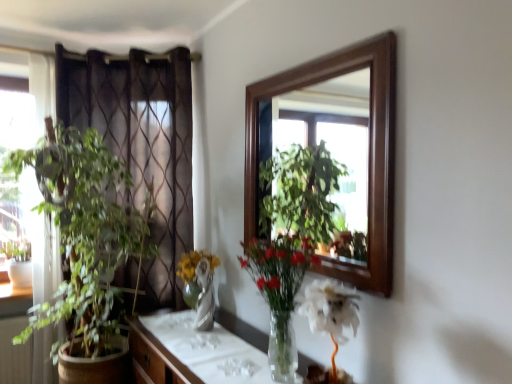
At what (x,y) coordinates should I click in order to perform the action: click on wooden cabinet at center. Please return your answer as a coordinate pair (x, y). This screenshot has height=384, width=512. Looking at the image, I should click on (193, 353).

This screenshot has width=512, height=384. What do you see at coordinates (280, 292) in the screenshot? I see `translucent glass vase at center, positioned as the first houseplant in front-to-back order` at bounding box center [280, 292].

How much space does translucent glass vase at center, positioned as the first houseplant in front-to-back order, occupy horizontally?

It is 5.62 inches.

Locate an element on the screen. The height and width of the screenshot is (384, 512). brown sheer curtain at left is located at coordinates (141, 143).

In the scene shown: Can translucent glass vase at center, positioned as the first houseplant in front-to-back order, be found inside wooden cabinet at center?

No, translucent glass vase at center, positioned as the first houseplant in front-to-back order, is located outside of wooden cabinet at center.

Between wooden cabinet at center and translucent glass vase at center, which is the second houseplant from left to right, which one has smaller width?

translucent glass vase at center, which is the second houseplant from left to right.

Identify the location of the 1st houseplant located above the wooden cabinet at center (from a real-world perspective). Image resolution: width=512 pixels, height=384 pixels. (280, 292).

Considering the relative sizes of wooden cabinet at center and translucent glass vase at center, marked as the 1th houseplant in a right-to-left arrangement, in the image provided, is wooden cabinet at center bigger than translucent glass vase at center, marked as the 1th houseplant in a right-to-left arrangement,?

Indeed, wooden cabinet at center has a larger size compared to translucent glass vase at center, marked as the 1th houseplant in a right-to-left arrangement.

Does green leafy plant at left, the first houseplant when ordered from back to front, have a lesser height compared to translucent glass vase at center, marked as the 1th houseplant in a right-to-left arrangement?

No.

Which is correct: green leafy plant at left, acting as the 1th houseplant starting from the left, is inside translucent glass vase at center, marked as the 1th houseplant in a right-to-left arrangement, or outside of it?

green leafy plant at left, acting as the 1th houseplant starting from the left, is not inside translucent glass vase at center, marked as the 1th houseplant in a right-to-left arrangement, it's outside.

Does point (99, 193) appear closer or farther from the camera than point (284, 321)?

Clearly, point (99, 193) is more distant from the camera than point (284, 321).

In order to click on houseplant below the green leafy plant at left, the second houseplant when ordered from right to left (from a real-world perspective) in this screenshot , I will do 280,292.

Is brown sheer curtain at left in front of or behind wooden cabinet at center in the image?

In the image, brown sheer curtain at left appears behind wooden cabinet at center.

This screenshot has height=384, width=512. I want to click on cabinetry in front of the brown sheer curtain at left, so click(193, 353).

From the picture: From a real-world perspective, which is physically above, brown sheer curtain at left or wooden cabinet at center?

In real-world perspective, brown sheer curtain at left is above.

Is the depth of wooden cabinet at center less than that of brown sheer curtain at left?

Yes, it is.

Is wooden cabinet at center aimed at brown sheer curtain at left?

No, wooden cabinet at center does not turn towards brown sheer curtain at left.

How different are the orientations of wooden cabinet at center and brown sheer curtain at left in degrees?

39.9 degrees separate the facing orientations of wooden cabinet at center and brown sheer curtain at left.

Which point is more forward, (169, 373) or (169, 72)?

Positioned in front is point (169, 373).

Considering the relative sizes of translucent glass vase at center, positioned as the first houseplant in front-to-back order, and brown sheer curtain at left in the image provided, is translucent glass vase at center, positioned as the first houseplant in front-to-back order, shorter than brown sheer curtain at left?

Correct, translucent glass vase at center, positioned as the first houseplant in front-to-back order, is not as tall as brown sheer curtain at left.

From the picture: Is the depth of translucent glass vase at center, which is the second houseplant from left to right, greater than that of brown sheer curtain at left?

No, translucent glass vase at center, which is the second houseplant from left to right, is closer to the camera.

Between green leafy plant at left, the first houseplant when ordered from back to front, and brown sheer curtain at left, which one appears on the right side from the viewer's perspective?

From the viewer's perspective, brown sheer curtain at left appears more on the right side.

Considering the sizes of objects green leafy plant at left, the second houseplant when ordered from right to left, and brown sheer curtain at left in the image provided, who is wider, green leafy plant at left, the second houseplant when ordered from right to left, or brown sheer curtain at left?

Wider between the two is green leafy plant at left, the second houseplant when ordered from right to left.

Is green leafy plant at left, the first houseplant when ordered from back to front, turned away from brown sheer curtain at left?

Yes, brown sheer curtain at left is at the back of green leafy plant at left, the first houseplant when ordered from back to front.

From a real-world perspective, is brown sheer curtain at left physically below translucent glass vase at center, the second houseplant in the back-to-front sequence?

No, from a real-world perspective, brown sheer curtain at left is not below translucent glass vase at center, the second houseplant in the back-to-front sequence.

Between brown sheer curtain at left and translucent glass vase at center, positioned as the first houseplant in front-to-back order, which one is positioned behind?

brown sheer curtain at left is more distant.

Which object is positioned more to the left, brown sheer curtain at left or translucent glass vase at center, marked as the 1th houseplant in a right-to-left arrangement?

brown sheer curtain at left.

Is brown sheer curtain at left far from translucent glass vase at center, positioned as the first houseplant in front-to-back order?

Yes, brown sheer curtain at left and translucent glass vase at center, positioned as the first houseplant in front-to-back order, are quite far apart.

Image resolution: width=512 pixels, height=384 pixels. There is a wooden cabinet at center. What are the coordinates of `the 1st houseplant above it (from the image's perspective)` in the screenshot? It's located at (280, 292).

This screenshot has height=384, width=512. Find the location of `houseplant located on the right of green leafy plant at left, which is the 2th houseplant in front-to-back order`. houseplant located on the right of green leafy plant at left, which is the 2th houseplant in front-to-back order is located at coordinates (280, 292).

Looking at the image, which one is located closer to wooden cabinet at center, brown sheer curtain at left or translucent glass vase at center, positioned as the first houseplant in front-to-back order?

Based on the image, translucent glass vase at center, positioned as the first houseplant in front-to-back order, appears to be nearer to wooden cabinet at center.

When comparing their distances from green leafy plant at left, acting as the 1th houseplant starting from the left, does translucent glass vase at center, positioned as the first houseplant in front-to-back order, or brown sheer curtain at left seem further?

translucent glass vase at center, positioned as the first houseplant in front-to-back order, is positioned further to the anchor green leafy plant at left, acting as the 1th houseplant starting from the left.

Which object lies further to the anchor point brown sheer curtain at left, translucent glass vase at center, positioned as the first houseplant in front-to-back order, or wooden cabinet at center?

Among the two, translucent glass vase at center, positioned as the first houseplant in front-to-back order, is located further to brown sheer curtain at left.

When comparing their distances from translucent glass vase at center, which is the second houseplant from left to right, does wooden cabinet at center or brown sheer curtain at left seem closer?

wooden cabinet at center lies closer to translucent glass vase at center, which is the second houseplant from left to right, than the other object.

Considering their positions, is brown sheer curtain at left positioned further to wooden cabinet at center than green leafy plant at left, the first houseplant when ordered from back to front?

The object further to wooden cabinet at center is brown sheer curtain at left.

Based on their spatial positions, is translucent glass vase at center, positioned as the first houseplant in front-to-back order, or brown sheer curtain at left further from wooden cabinet at center?

Among the two, brown sheer curtain at left is located further to wooden cabinet at center.

When comparing their distances from translucent glass vase at center, which is the second houseplant from left to right, does brown sheer curtain at left or wooden cabinet at center seem closer?

Based on the image, wooden cabinet at center appears to be nearer to translucent glass vase at center, which is the second houseplant from left to right.

Based on the photo, estimate the real-world distances between objects in this image. Which object is closer to translucent glass vase at center, which is the second houseplant from left to right, wooden cabinet at center or green leafy plant at left, the first houseplant when ordered from back to front?

Based on the image, wooden cabinet at center appears to be nearer to translucent glass vase at center, which is the second houseplant from left to right.

Locate an element on the screen. The image size is (512, 384). curtain located between green leafy plant at left, which is the 2th houseplant in front-to-back order, and translucent glass vase at center, marked as the 1th houseplant in a right-to-left arrangement, in the left-right direction is located at coordinates (141, 143).

Where is `cabinetry between green leafy plant at left, the second houseplant when ordered from right to left, and translucent glass vase at center, positioned as the first houseplant in front-to-back order, from left to right`? Image resolution: width=512 pixels, height=384 pixels. cabinetry between green leafy plant at left, the second houseplant when ordered from right to left, and translucent glass vase at center, positioned as the first houseplant in front-to-back order, from left to right is located at coordinates (193, 353).